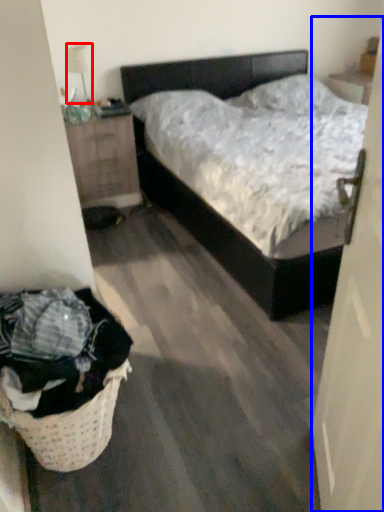
Question: Which point is closer to the camera, lamp (highlighted by a red box) or door (highlighted by a blue box)?

Choices:
 (A) lamp
 (B) door

Answer: (B)